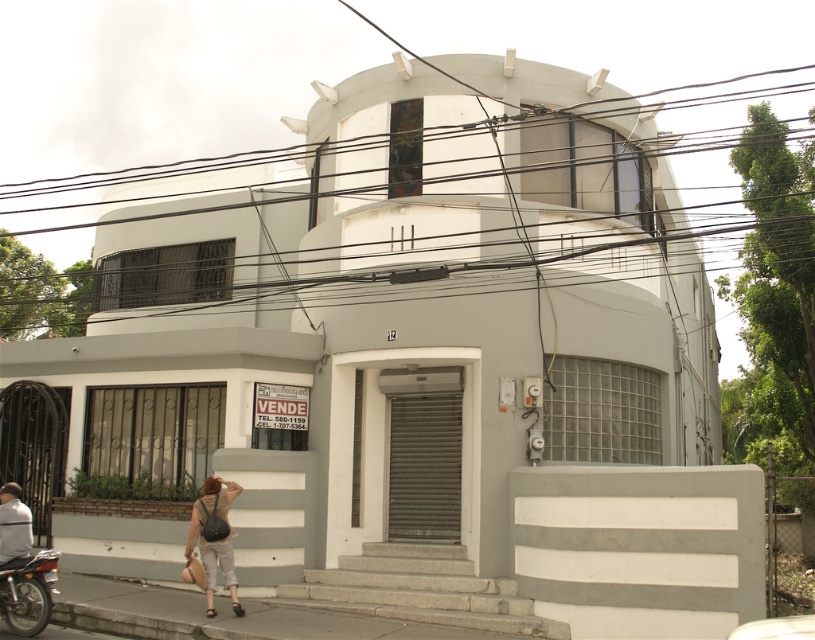
You are a delivery person trying to secure a package on the roof of the building. The roof has a black wire at upper center and a gray fabric jacket at lower left. Which object can you use to tie the package securely?

The black wire at upper center has a larger size compared to the gray fabric jacket at lower left, so it is more suitable for tying the package securely.

You are a delivery person trying to secure a package on the roof of the building. The roof has a flat surface with small decorative elements at the corners. You have a black wire at upper center and a gray fabric jacket at lower left. Which object can you use to secure the package more effectively, considering their widths?

The black wire at upper center has a larger width than the gray fabric jacket at lower left, making it more suitable for securing the package effectively.